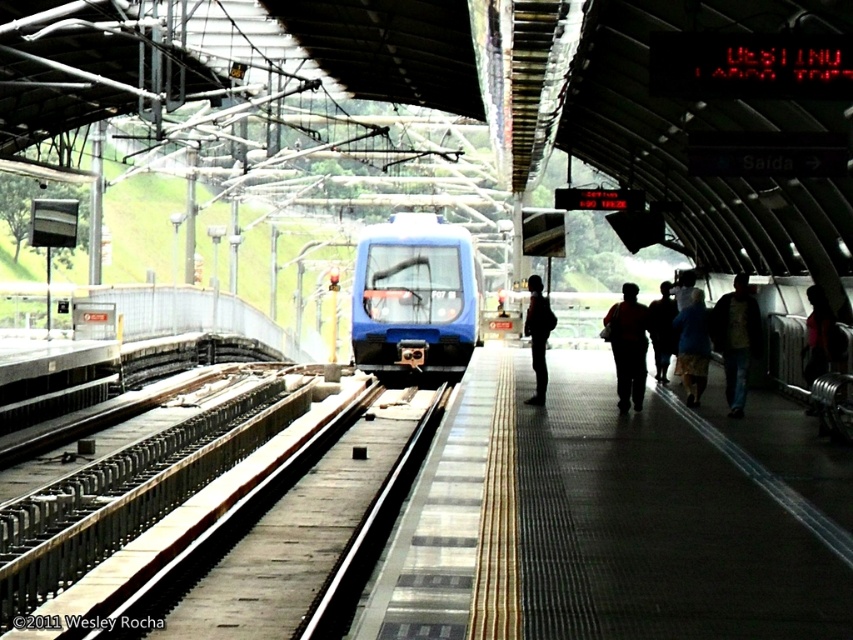
You are standing at the center of the train station platform and see the point marked at coordinates (x=735, y=339). What object is located at that point?

The point at coordinates (x=735, y=339) corresponds to dark blue jeans at right.

You are a passenger on the platform and want to board the blue glossy train at center. There is a blue fabric jacket at center blocking your path. Can you step around the jacket to reach the train?

The blue glossy train at center might be wider than blue fabric jacket at center, so there could be enough space to step around the jacket and reach the train.

You are a passenger waiting for a train and need to know if you can step onto the textured concrete platform at center from the dark blue jeans at right. Can you do that easily?

The textured concrete platform at center is not as tall as dark blue jeans at right, so stepping onto it from the dark blue jeans at right would be easy since the platform is lower in height.